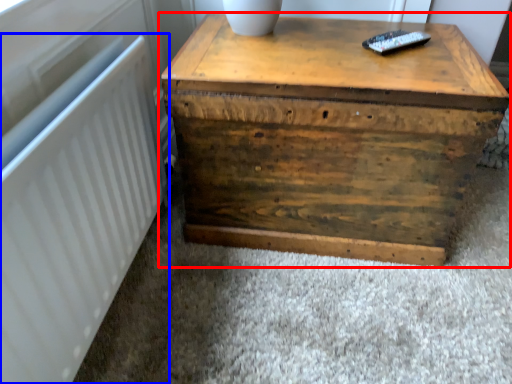
Question: Which object appears farthest to the camera in this image, table (highlighted by a red box) or radiator (highlighted by a blue box)?

Choices:
 (A) table
 (B) radiator

Answer: (A)